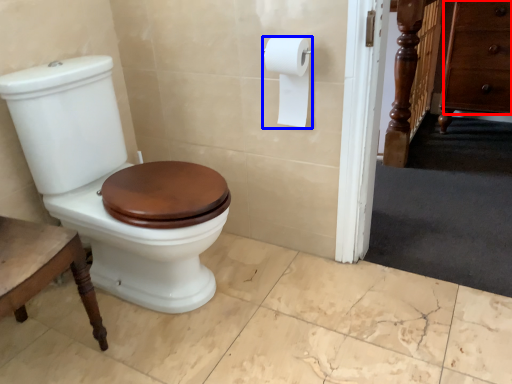
Question: Among these objects, which one is farthest to the camera, drawer (highlighted by a red box) or toilet paper (highlighted by a blue box)?

Choices:
 (A) drawer
 (B) toilet paper

Answer: (A)